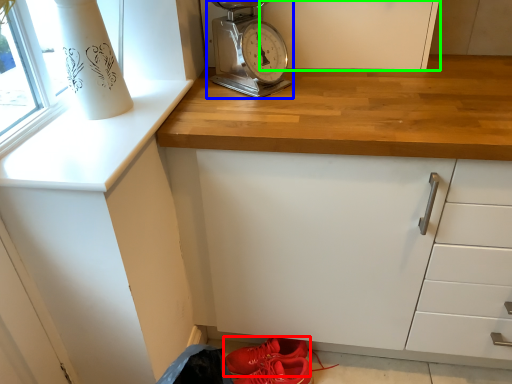
Question: Based on their relative distances, which object is farther from footwear (highlighted by a red box)? Choose from home appliance (highlighted by a blue box) and cabinetry (highlighted by a green box).

Choices:
 (A) home appliance
 (B) cabinetry

Answer: (B)